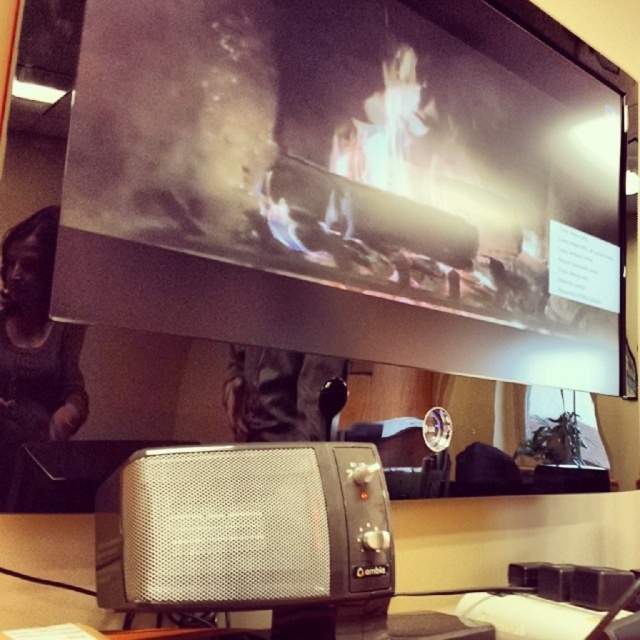
You are organizing a virtual meeting and need to ensure clear audio. You have the metallic glass fireplace at upper center and the silver mesh speaker at center in your view. Which object should you adjust to improve sound quality?

The silver mesh speaker at center is behind the metallic glass fireplace at upper center, so adjusting the silver mesh speaker at center could help improve sound quality by moving it forward or repositioning it relative to the fireplace.

You are organizing a small party in this office and want to place a decorative plant between the metallic glass fireplace at upper center and the silver mesh speaker at center. Based on their positions, where should you place the plant?

The metallic glass fireplace at upper center is positioned over the silver mesh speaker at center, so you should place the decorative plant between them either below the fireplace and above the speaker or in the space between their overlapping areas.

Consider the image. You are an interior designer assessing the placement of items in this office. The metallic glass fireplace at upper center and the silver mesh speaker at center are both on the desk. Which object takes up more space on the desk?

The metallic glass fireplace at upper center is bigger than the silver mesh speaker at center, so it takes up more space on the desk.